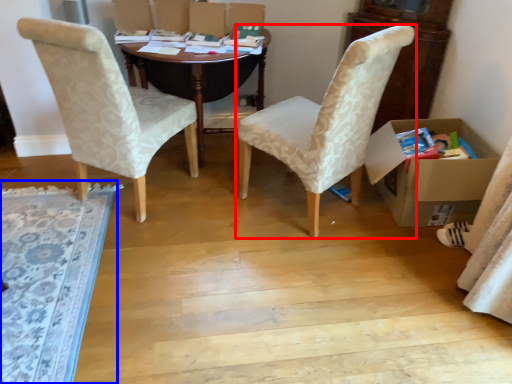
Question: Which object is closer to the camera taking this photo, chair (highlighted by a red box) or mat (highlighted by a blue box)?

Choices:
 (A) chair
 (B) mat

Answer: (B)